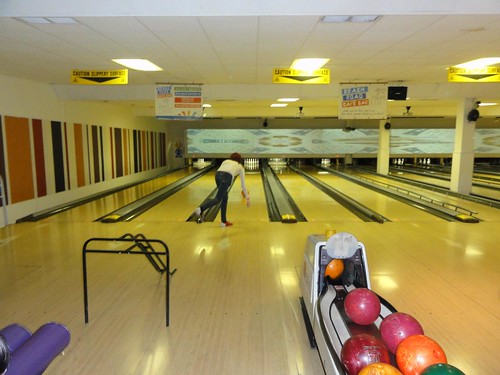
This screenshot has height=375, width=500. In order to click on lights in this screenshot , I will do `click(149, 61)`, `click(318, 59)`, `click(281, 108)`, `click(203, 106)`, `click(487, 101)`, `click(486, 61)`, `click(410, 96)`.